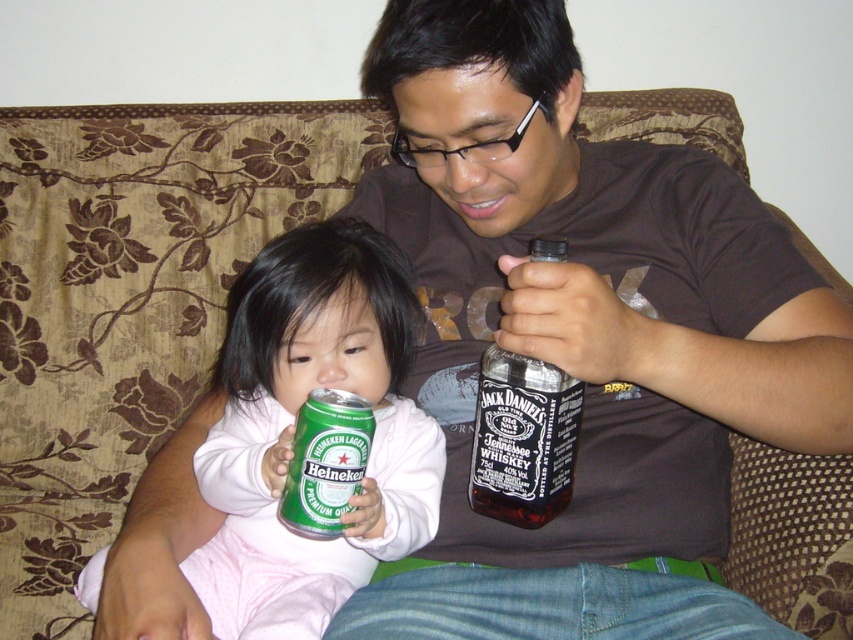
You are a photographer trying to capture a closeup shot of the green matte heineken can at left. Given that the camera requires a minimum focus distance of 26 inches to avoid blurriness, will you be able to take a clear photo without moving the can?

The green matte heineken can at left is 25.86 inches away from the camera, which is less than the required minimum focus distance of 26 inches. Therefore, the photo will likely be blurry unless the camera is moved further away or the can is moved closer.